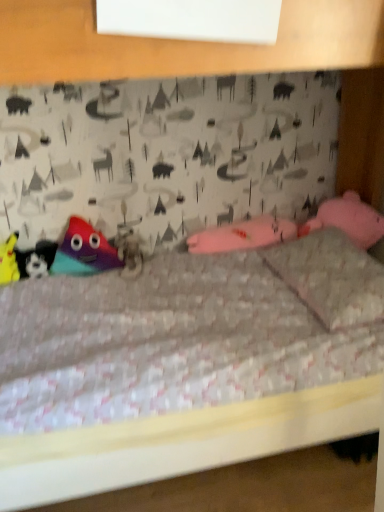
Question: Can you confirm if matte black plush at left, which is the 2th toy in left-to-right order, is thinner than multicolored plush toy at left, which ranks as the first toy in right-to-left order?

Choices:
 (A) no
 (B) yes

Answer: (A)

Question: Could you tell me if matte black plush at left, which is counted as the second toy, starting from the right, is facing multicolored plush toy at left, which ranks as the first toy in right-to-left order?

Choices:
 (A) no
 (B) yes

Answer: (A)

Question: From a real-world perspective, does matte black plush at left, which is the 2th toy in left-to-right order, sit lower than multicolored plush toy at left, which ranks as the first toy in right-to-left order?

Choices:
 (A) no
 (B) yes

Answer: (B)

Question: Is matte black plush at left, which is the 2th toy in left-to-right order, to the right of multicolored plush toy at left, which ranks as the first toy in right-to-left order, from the viewer's perspective?

Choices:
 (A) no
 (B) yes

Answer: (A)

Question: From a real-world perspective, is matte black plush at left, which is the 2th toy in left-to-right order, on top of multicolored plush toy at left, arranged as the 3th toy when viewed from the left?

Choices:
 (A) yes
 (B) no

Answer: (B)

Question: Is matte black plush at left, which is the 2th toy in left-to-right order, outside of multicolored plush toy at left, which ranks as the first toy in right-to-left order?

Choices:
 (A) yes
 (B) no

Answer: (A)

Question: From a real-world perspective, is fuzzy fabric animal at center physically below multicolored plush toy at left, which ranks as the first toy in right-to-left order?

Choices:
 (A) no
 (B) yes

Answer: (B)

Question: Can you confirm if fuzzy fabric animal at center is wider than multicolored plush toy at left, arranged as the 3th toy when viewed from the left?

Choices:
 (A) no
 (B) yes

Answer: (B)

Question: Is fuzzy fabric animal at center turned away from multicolored plush toy at left, arranged as the 3th toy when viewed from the left?

Choices:
 (A) yes
 (B) no

Answer: (B)

Question: Can multicolored plush toy at left, which ranks as the first toy in right-to-left order, be found inside fuzzy fabric animal at center?

Choices:
 (A) no
 (B) yes

Answer: (A)

Question: Is fuzzy fabric animal at center with multicolored plush toy at left, which ranks as the first toy in right-to-left order?

Choices:
 (A) yes
 (B) no

Answer: (B)

Question: Does fuzzy fabric animal at center have a lesser width compared to multicolored plush toy at left, arranged as the 3th toy when viewed from the left?

Choices:
 (A) yes
 (B) no

Answer: (B)

Question: From a real-world perspective, is matte black plush at left, which is counted as the second toy, starting from the right, over pink fabric pillow at upper right?

Choices:
 (A) yes
 (B) no

Answer: (B)